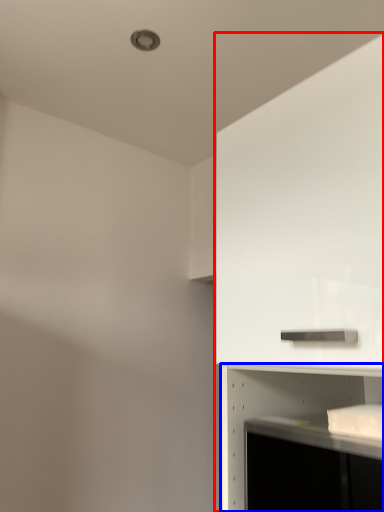
Question: Which object is further to the camera taking this photo, cabinetry (highlighted by a red box) or shelf (highlighted by a blue box)?

Choices:
 (A) cabinetry
 (B) shelf

Answer: (B)